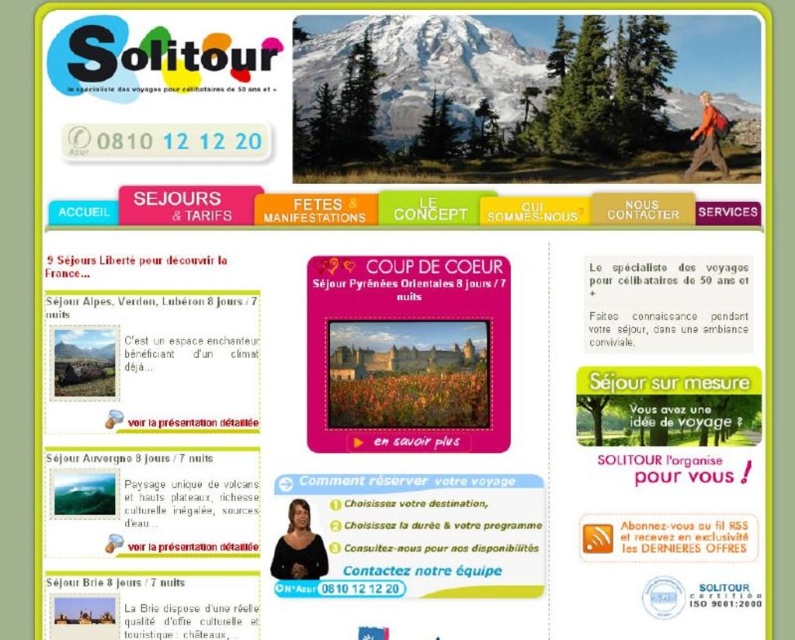
You are designing a website for a travel agency targeting seniors. You notice the matte orange backpack at upper right and the matte pink button at center. Which object should you click if you want to select the larger one?

The matte orange backpack at upper right is larger in size than the matte pink button at center, so you should click the matte orange backpack at upper right.

You are a travel agent working with the Solitour webpage. You need to place a new promotional sticker that is 2 inches wide between the matte black woman at bottom center and the matte pink button at center. Is there enough space to place the sticker without overlapping either object?

The distance between the matte black woman at bottom center and the matte pink button at center is 21.93 inches. Since the sticker is only 2 inches wide, there is sufficient space to place it between them without overlapping either object.

You are designing a travel brochure for Solitour and need to place a photo of a sunset over the Mediterranean Sea between the matte orange backpack at upper right and the matte pink button at center. Considering their sizes, which object should the photo be closer to?

The matte orange backpack at upper right has a lesser width compared to the matte pink button at center, so the photo should be placed closer to the matte pink button at center to ensure proper spacing between the objects.